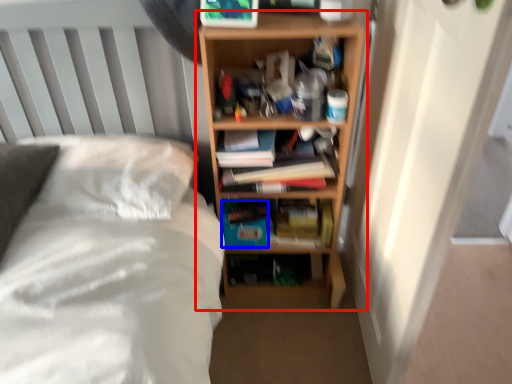
Question: Which point is further to the camera, shelf (highlighted by a red box) or paperback book (highlighted by a blue box)?

Choices:
 (A) shelf
 (B) paperback book

Answer: (B)